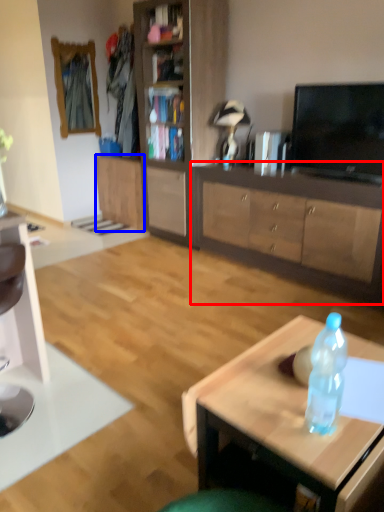
Question: Which object appears farthest to the camera in this image, cabinetry (highlighted by a red box) or cabinetry (highlighted by a blue box)?

Choices:
 (A) cabinetry
 (B) cabinetry

Answer: (B)